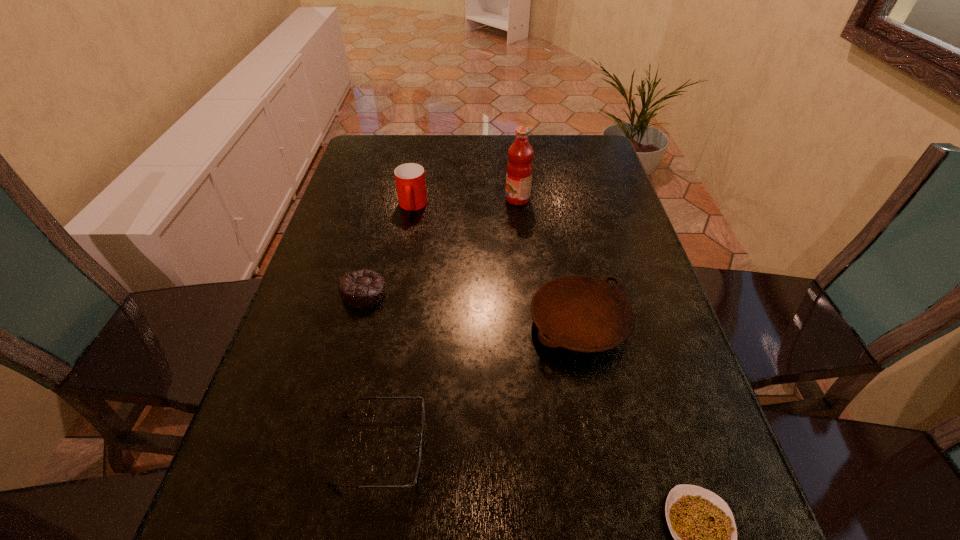
Where is `fruit juice`? fruit juice is located at coordinates pyautogui.click(x=519, y=170).

Image resolution: width=960 pixels, height=540 pixels. Identify the location of cup. (410, 178).

Find the location of a particular element. plate is located at coordinates (580, 313).

Identify the location of beanbag. The height and width of the screenshot is (540, 960). (362, 288).

The image size is (960, 540). What are the coordinates of `spectacles` in the screenshot? It's located at (345, 413).

The height and width of the screenshot is (540, 960). I want to click on vacant space situated 0.200m on the front label of the tallest object, so click(437, 199).

Locate an element on the screen. The height and width of the screenshot is (540, 960). vacant point located on the front label of the tallest object is located at coordinates (402, 199).

The image size is (960, 540). I want to click on vacant region located 0.110m on the front label of the tallest object, so click(468, 199).

At what (x,y) coordinates should I click in order to perform the action: click on vacant space situated 0.240m on the side of the second tallest object with the handle. Please return your answer as a coordinate pair (x, y). Image resolution: width=960 pixels, height=540 pixels. Looking at the image, I should click on (399, 280).

You are a GUI agent. You are given a task and a screenshot of the screen. Output one action in this format:
    pyautogui.click(x=<x>, y=<y>)
    Task: Click on the vacant space situated 0.210m on the left of the plate
    
    Given the screenshot: What is the action you would take?
    pyautogui.click(x=433, y=323)